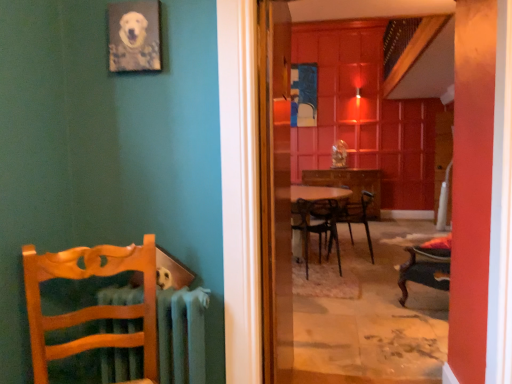
Question: Does metallic black chair at center, positioned as the first chair in right-to-left order, have a greater height compared to metallic radiator at left?

Choices:
 (A) yes
 (B) no

Answer: (A)

Question: From a real-world perspective, is metallic black chair at center, positioned as the first chair in right-to-left order, below metallic radiator at left?

Choices:
 (A) yes
 (B) no

Answer: (A)

Question: From the image's perspective, does metallic black chair at center, positioned as the first chair in right-to-left order, appear higher than metallic radiator at left?

Choices:
 (A) no
 (B) yes

Answer: (B)

Question: Can you confirm if metallic black chair at center, acting as the third chair starting from the left, is bigger than metallic radiator at left?

Choices:
 (A) yes
 (B) no

Answer: (A)

Question: Considering the relative sizes of metallic black chair at center, positioned as the first chair in right-to-left order, and metallic radiator at left in the image provided, is metallic black chair at center, positioned as the first chair in right-to-left order, shorter than metallic radiator at left?

Choices:
 (A) yes
 (B) no

Answer: (B)

Question: Is metallic black chair at center, which appears as the third chair when viewed from the front, looking in the opposite direction of metallic radiator at left?

Choices:
 (A) yes
 (B) no

Answer: (B)

Question: Can you confirm if transparent glass screen door at center, placed as the 2th screen door when sorted from back to front, is smaller than wooden chair at left, the first chair when ordered from front to back?

Choices:
 (A) no
 (B) yes

Answer: (A)

Question: From a real-world perspective, is transparent glass screen door at center, placed as the 2th screen door when sorted from back to front, physically below wooden chair at left, which is counted as the 3th chair, starting from the right?

Choices:
 (A) no
 (B) yes

Answer: (A)

Question: Does transparent glass screen door at center, placed as the 2th screen door when sorted from back to front, have a lesser height compared to wooden chair at left, which is the 1th chair in left-to-right order?

Choices:
 (A) no
 (B) yes

Answer: (A)

Question: Is wooden chair at left, the first chair when ordered from front to back, completely or partially inside transparent glass screen door at center, which ranks as the first screen door in front-to-back order?

Choices:
 (A) no
 (B) yes

Answer: (A)

Question: Is transparent glass screen door at center, which ranks as the first screen door in front-to-back order, at the right side of wooden chair at left, which is the 1th chair in left-to-right order?

Choices:
 (A) yes
 (B) no

Answer: (A)

Question: Is transparent glass screen door at center, placed as the 2th screen door when sorted from back to front, far away from wooden chair at left, which is counted as the 3th chair, starting from the right?

Choices:
 (A) no
 (B) yes

Answer: (B)

Question: Could you tell me if metallic radiator at left is turned towards wooden chair at center, the 2th chair positioned from the left?

Choices:
 (A) yes
 (B) no

Answer: (B)